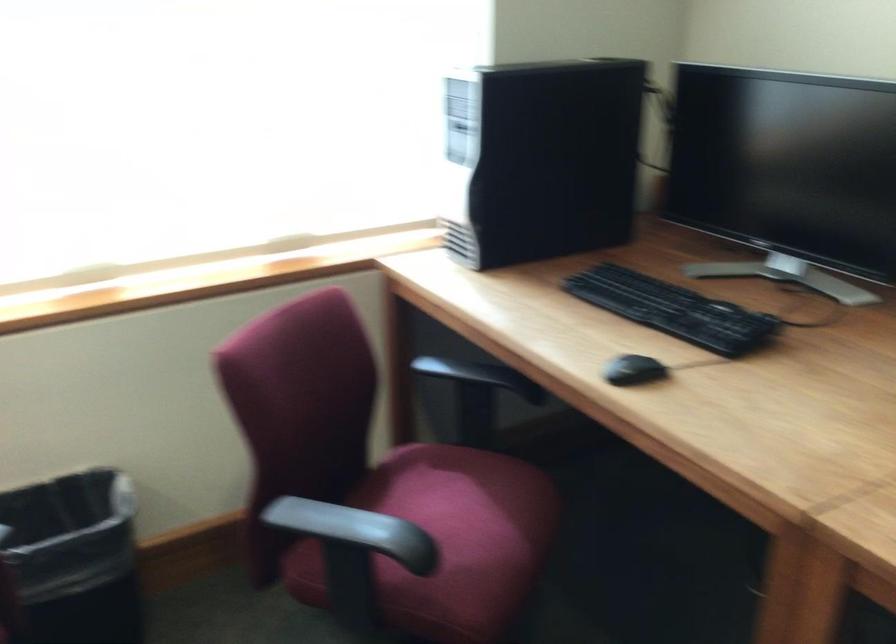
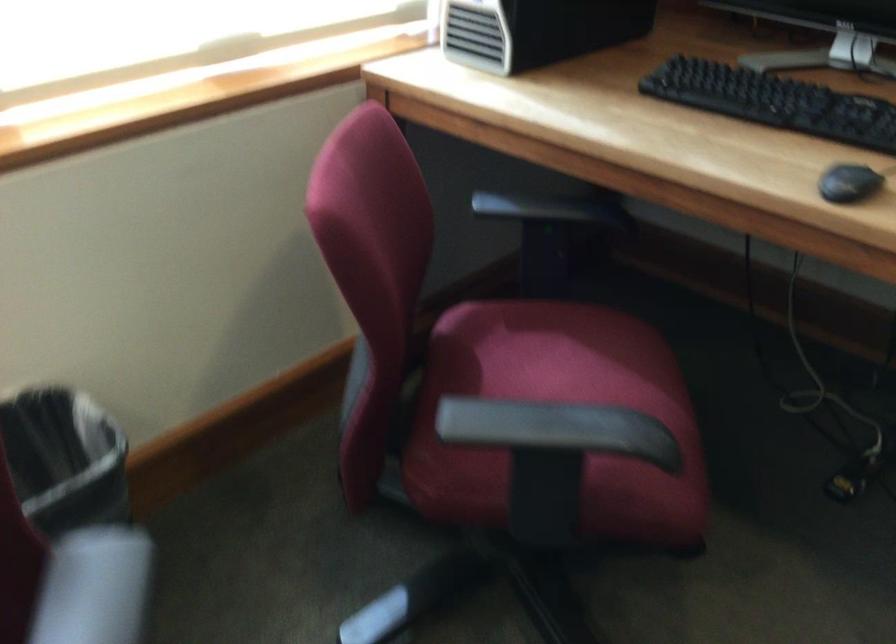
The point at (323, 522) is marked in the first image. Where is the corresponding point in the second image?

(528, 424)